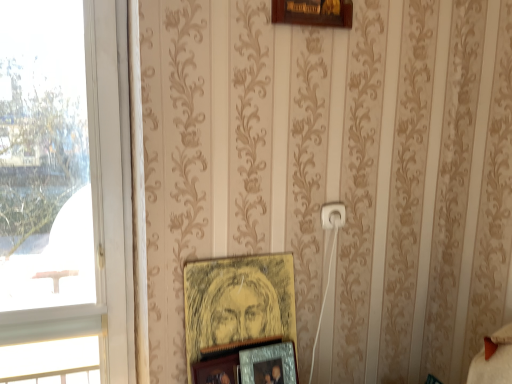
Question: Is white plastic electric outlet at center positioned beyond the bounds of wooden picture frame at lower center, the first picture frame in the bottom-to-top sequence?

Choices:
 (A) yes
 (B) no

Answer: (A)

Question: Does white plastic electric outlet at center have a lesser height compared to wooden picture frame at lower center, the third picture frame positioned from the top?

Choices:
 (A) yes
 (B) no

Answer: (A)

Question: Are white plastic electric outlet at center and wooden picture frame at lower center, the first picture frame in the bottom-to-top sequence, beside each other?

Choices:
 (A) no
 (B) yes

Answer: (A)

Question: Considering the relative sizes of white plastic electric outlet at center and wooden picture frame at lower center, the first picture frame in the bottom-to-top sequence, in the image provided, is white plastic electric outlet at center thinner than wooden picture frame at lower center, the first picture frame in the bottom-to-top sequence,?

Choices:
 (A) no
 (B) yes

Answer: (B)

Question: Is white plastic electric outlet at center positioned far away from wooden picture frame at lower center, the third picture frame positioned from the top?

Choices:
 (A) no
 (B) yes

Answer: (A)

Question: Is transparent glass window at left to the left or to the right of yellow paper picture frame at center, which appears as the third picture frame when ordered from the bottom, in the image?

Choices:
 (A) left
 (B) right

Answer: (A)

Question: From their relative heights in the image, would you say transparent glass window at left is taller or shorter than yellow paper picture frame at center, which is the first picture frame from top to bottom?

Choices:
 (A) short
 (B) tall

Answer: (B)

Question: In the image, is transparent glass window at left positioned in front of or behind yellow paper picture frame at center, which appears as the third picture frame when ordered from the bottom?

Choices:
 (A) behind
 (B) front

Answer: (B)

Question: Considering the positions of point (113, 4) and point (274, 294), is point (113, 4) closer or farther from the camera than point (274, 294)?

Choices:
 (A) farther
 (B) closer

Answer: (B)

Question: Considering the positions of yellow paper picture frame at center, which is the first picture frame from top to bottom, and transparent glass window at left in the image, is yellow paper picture frame at center, which is the first picture frame from top to bottom, wider or thinner than transparent glass window at left?

Choices:
 (A) wide
 (B) thin

Answer: (B)

Question: Is yellow paper picture frame at center, which is the first picture frame from top to bottom, taller or shorter than transparent glass window at left?

Choices:
 (A) short
 (B) tall

Answer: (A)

Question: In the image, is yellow paper picture frame at center, which is the first picture frame from top to bottom, positioned in front of or behind transparent glass window at left?

Choices:
 (A) front
 (B) behind

Answer: (B)

Question: From a real-world perspective, relative to transparent glass window at left, is yellow paper picture frame at center, which is the first picture frame from top to bottom, vertically above or below?

Choices:
 (A) below
 (B) above

Answer: (A)

Question: Considering the positions of point (240, 355) and point (197, 365), is point (240, 355) closer or farther from the camera than point (197, 365)?

Choices:
 (A) farther
 (B) closer

Answer: (A)

Question: Would you say metallic silver photo frame at lower center, which is the 2th picture frame from top to bottom, is inside or outside wooden picture frame at lower center, the third picture frame positioned from the top?

Choices:
 (A) inside
 (B) outside

Answer: (B)